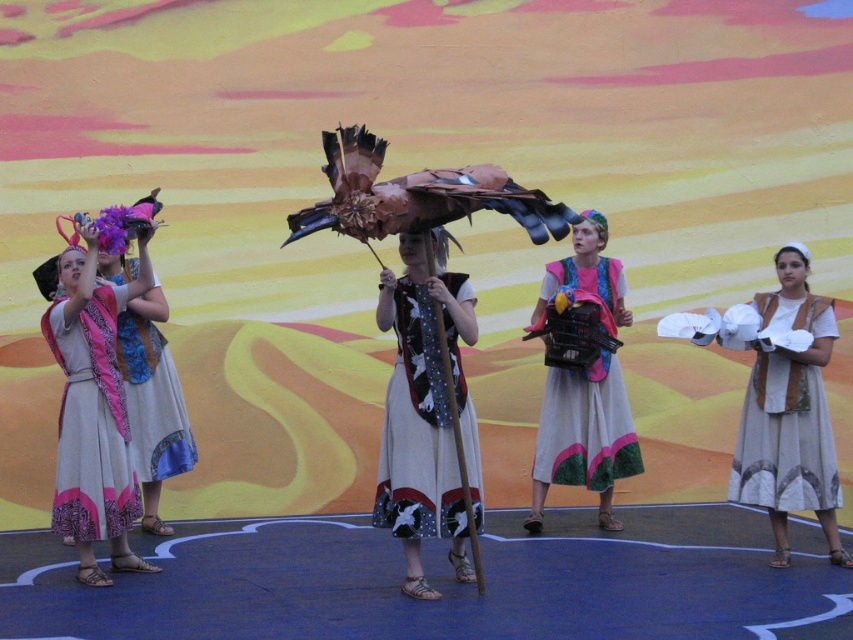
Based on the photo, you are a costume designer examining the performers on stage. You need to determine which item has a greater width between the matte pink scarf at left and the matte blue fabric dress at left. Which one is wider?

The matte pink scarf at left is wider than the matte blue fabric dress at left according to the description.

You are an audience member sitting in the front row of the theater. You notice two points on the stage. The first point is labeled as point (x=462, y=506) and the second is labeled as point (x=570, y=467). Which point is closer to you?

Point (x=462, y=506) is closer to the viewer than point (x=570, y=467).

You are a costume designer who needs to ensure that the white cotton dress at center and white cotton gloves at center are proportionate. Based on the description, which item is larger in size?

The white cotton dress at center is larger in size compared to the white cotton gloves at center.